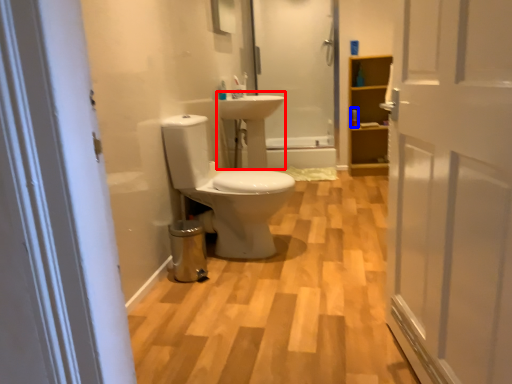
Question: Which of the following is the closest to the observer, sink (highlighted by a red box) or toiletry (highlighted by a blue box)?

Choices:
 (A) sink
 (B) toiletry

Answer: (A)